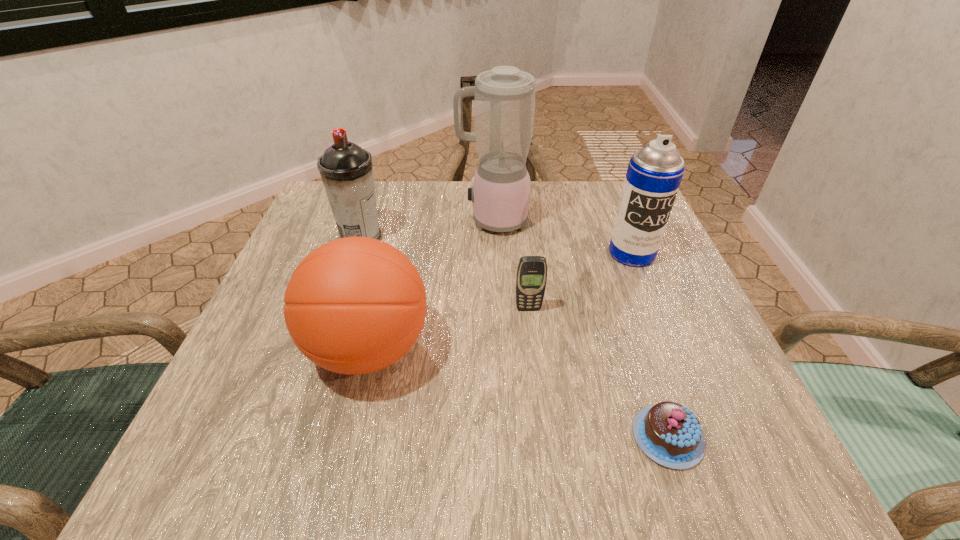
Locate an element on the screen. Image resolution: width=960 pixels, height=540 pixels. free space between the tallest object and the third shortest object is located at coordinates (431, 285).

The height and width of the screenshot is (540, 960). I want to click on vacant space in between the left aerosol can and the food processor, so click(x=427, y=229).

Where is `vacant space that's between the left aerosol can and the fifth tallest object`? The image size is (960, 540). vacant space that's between the left aerosol can and the fifth tallest object is located at coordinates (444, 273).

Where is `vacant area that lies between the left aerosol can and the chocolate cake`? Image resolution: width=960 pixels, height=540 pixels. vacant area that lies between the left aerosol can and the chocolate cake is located at coordinates (515, 337).

Where is `vacant space that is in between the food processor and the shortest object`? The height and width of the screenshot is (540, 960). vacant space that is in between the food processor and the shortest object is located at coordinates (581, 329).

Where is `free spot between the cellular telephone and the nearest object`? free spot between the cellular telephone and the nearest object is located at coordinates (598, 373).

The width and height of the screenshot is (960, 540). Find the location of `free spot between the fifth tallest object and the right aerosol can`. free spot between the fifth tallest object and the right aerosol can is located at coordinates (580, 281).

The height and width of the screenshot is (540, 960). What are the coordinates of `free space between the cellular telephone and the third shortest object` in the screenshot? It's located at click(x=448, y=329).

You are a GUI agent. You are given a task and a screenshot of the screen. Output one action in this format:
    pyautogui.click(x=<x>, y=<y>)
    Task: Click on the free space between the third shortest object and the right aerosol can
    
    Given the screenshot: What is the action you would take?
    pyautogui.click(x=500, y=301)

The height and width of the screenshot is (540, 960). What are the coordinates of `free space between the second shortest object and the food processor` in the screenshot? It's located at (511, 265).